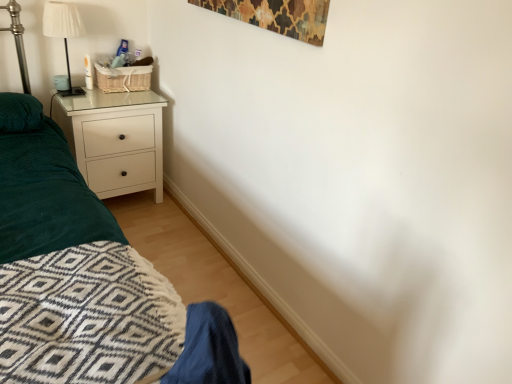
Where is `white pleated fabric lampshade at upper left`? This screenshot has width=512, height=384. white pleated fabric lampshade at upper left is located at coordinates pos(63,32).

What do you see at coordinates (63, 32) in the screenshot? I see `white pleated fabric lampshade at upper left` at bounding box center [63, 32].

What do you see at coordinates (115, 141) in the screenshot? I see `white glossy chest of drawers at left` at bounding box center [115, 141].

Measure the distance between white glossy chest of drawers at left and camera.

white glossy chest of drawers at left is 2.15 meters from camera.

Locate an element on the screen. Image resolution: width=512 pixels, height=384 pixels. white glossy chest of drawers at left is located at coordinates (115, 141).

You are a GUI agent. You are given a task and a screenshot of the screen. Output one action in this format:
    pyautogui.click(x=<x>, y=<y>)
    Task: Click on the white pleated fabric lampshade at upper left
    
    Given the screenshot: What is the action you would take?
    pyautogui.click(x=63, y=32)

Can you confirm if white pleated fabric lampshade at upper left is positioned to the right of white glossy chest of drawers at left?

In fact, white pleated fabric lampshade at upper left is to the left of white glossy chest of drawers at left.

Which object is more forward, white pleated fabric lampshade at upper left or white glossy chest of drawers at left?

white pleated fabric lampshade at upper left is in front.

Does point (51, 19) come behind point (117, 181)?

No, (51, 19) is in front of (117, 181).

From the image's perspective, is white pleated fabric lampshade at upper left positioned above or below white glossy chest of drawers at left?

white pleated fabric lampshade at upper left is situated higher than white glossy chest of drawers at left in the image.

From a real-world perspective, is white pleated fabric lampshade at upper left positioned under white glossy chest of drawers at left based on gravity?

No, from a real-world perspective, white pleated fabric lampshade at upper left is not under white glossy chest of drawers at left.

Is white pleated fabric lampshade at upper left wider than white glossy chest of drawers at left?

No.

Who is taller, white pleated fabric lampshade at upper left or white glossy chest of drawers at left?

white glossy chest of drawers at left is taller.

Based on the photo, between white pleated fabric lampshade at upper left and white glossy chest of drawers at left, which one has smaller size?

white pleated fabric lampshade at upper left.

Do you think white pleated fabric lampshade at upper left is within white glossy chest of drawers at left, or outside of it?

white pleated fabric lampshade at upper left is not inside white glossy chest of drawers at left, it's outside.

Would you consider white pleated fabric lampshade at upper left to be distant from white glossy chest of drawers at left?

white pleated fabric lampshade at upper left is near white glossy chest of drawers at left, not far away.

Is white pleated fabric lampshade at upper left oriented towards white glossy chest of drawers at left?

No, white pleated fabric lampshade at upper left is not turned towards white glossy chest of drawers at left.

Can you tell me how much white pleated fabric lampshade at upper left and white glossy chest of drawers at left differ in facing direction?

0.000498 degrees.

Find the location of a particular element. The width and height of the screenshot is (512, 384). lamp above the white glossy chest of drawers at left (from a real-world perspective) is located at coordinates (63, 32).

Between white glossy chest of drawers at left and white pleated fabric lampshade at upper left, which one appears on the right side from the viewer's perspective?

white glossy chest of drawers at left is more to the right.

Considering the positions of objects white glossy chest of drawers at left and white pleated fabric lampshade at upper left in the image provided, who is behind, white glossy chest of drawers at left or white pleated fabric lampshade at upper left?

white glossy chest of drawers at left is further from the camera.

Does point (68, 131) lie in front of point (53, 25)?

That is False.

From the image's perspective, relative to white pleated fabric lampshade at upper left, is white glossy chest of drawers at left above or below?

Based on their image positions, white glossy chest of drawers at left is located beneath white pleated fabric lampshade at upper left.

From a real-world perspective, is white glossy chest of drawers at left on white pleated fabric lampshade at upper left?

Actually, white glossy chest of drawers at left is physically below white pleated fabric lampshade at upper left in the real world.

In the scene shown: Between white glossy chest of drawers at left and white pleated fabric lampshade at upper left, which one has smaller width?

white pleated fabric lampshade at upper left is thinner.

Is white glossy chest of drawers at left taller than white pleated fabric lampshade at upper left?

Indeed, white glossy chest of drawers at left has a greater height compared to white pleated fabric lampshade at upper left.

Considering the sizes of objects white glossy chest of drawers at left and white pleated fabric lampshade at upper left in the image provided, who is bigger, white glossy chest of drawers at left or white pleated fabric lampshade at upper left?

Bigger between the two is white glossy chest of drawers at left.

Is white glossy chest of drawers at left located outside white pleated fabric lampshade at upper left?

Yes.

Is white glossy chest of drawers at left beside white pleated fabric lampshade at upper left?

white glossy chest of drawers at left and white pleated fabric lampshade at upper left are not in contact.

Could you tell me if white glossy chest of drawers at left is facing white pleated fabric lampshade at upper left?

No, white glossy chest of drawers at left does not turn towards white pleated fabric lampshade at upper left.

Can you tell me how much white glossy chest of drawers at left and white pleated fabric lampshade at upper left differ in facing direction?

There is a 0.000498-degree angle between the facing directions of white glossy chest of drawers at left and white pleated fabric lampshade at upper left.

Image resolution: width=512 pixels, height=384 pixels. Identify the location of lamp lying above the white glossy chest of drawers at left (from the image's perspective). (63, 32).

The image size is (512, 384). What are the coordinates of `lamp in front of the white glossy chest of drawers at left` in the screenshot? It's located at (63, 32).

Where is `chest of drawers behind the white pleated fabric lampshade at upper left`? The height and width of the screenshot is (384, 512). chest of drawers behind the white pleated fabric lampshade at upper left is located at coordinates (115, 141).